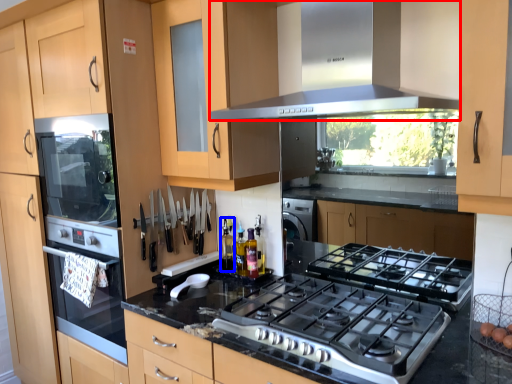
Question: Among these objects, which one is farthest to the camera, home appliance (highlighted by a red box) or bottle (highlighted by a blue box)?

Choices:
 (A) home appliance
 (B) bottle

Answer: (B)